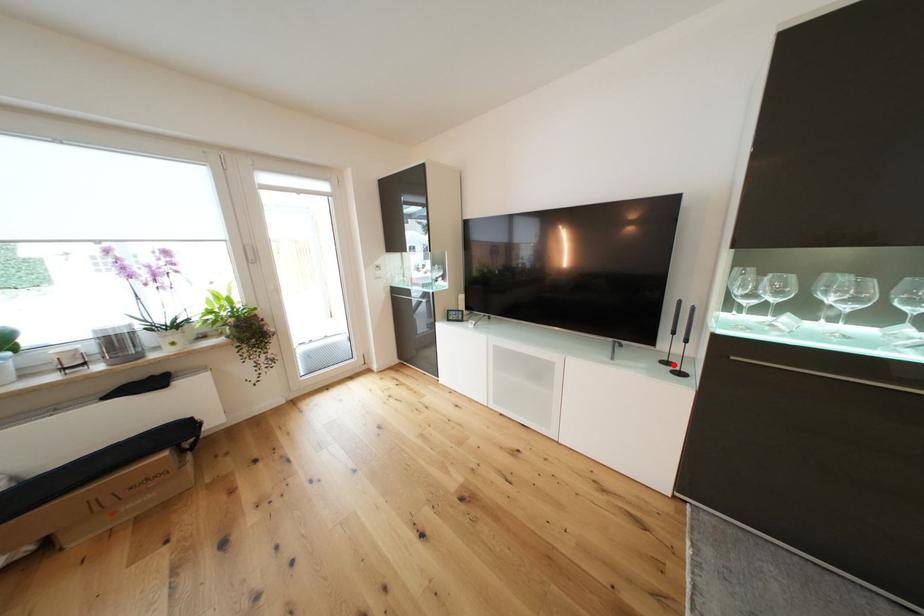
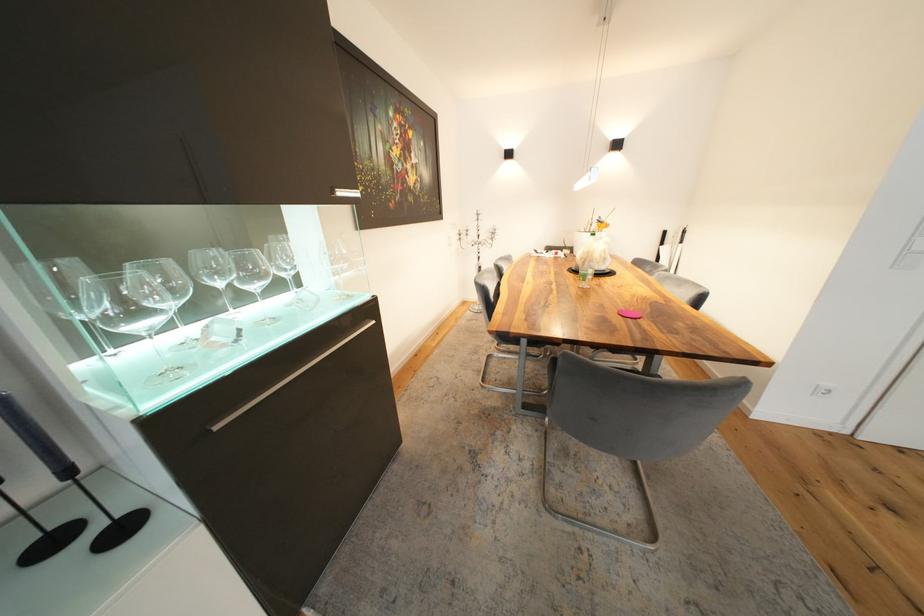
In the second image, find the point that corresponds to the highlighted location in the first image.

(59, 545)